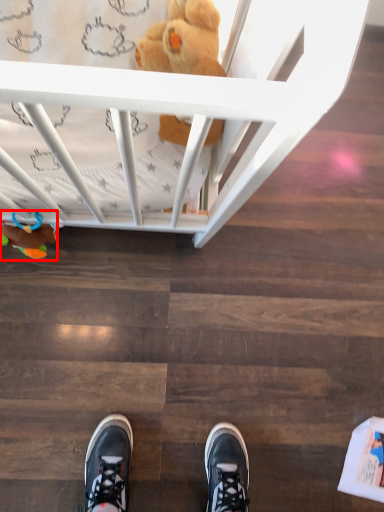
Question: From the image's perspective, what is the correct spatial relationship of toy (annotated by the red box) in relation to toy?

Choices:
 (A) below
 (B) above

Answer: (A)